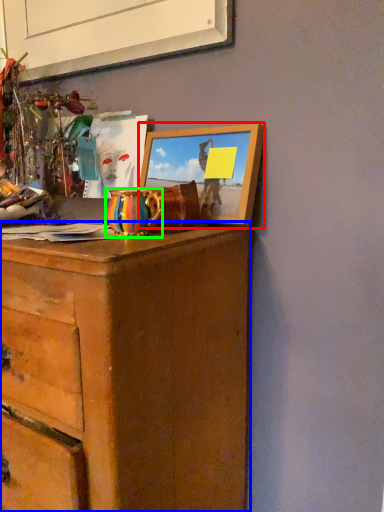
Question: Which is farther away from picture frame (highlighted by a red box)? chest of drawers (highlighted by a blue box) or vase (highlighted by a green box)?

Choices:
 (A) chest of drawers
 (B) vase

Answer: (A)